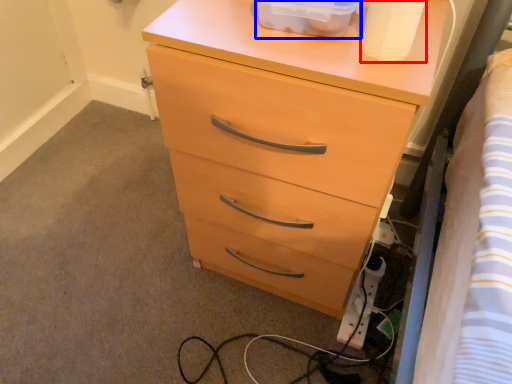
Question: Which object appears closest to the camera in this image, toilet paper (highlighted by a red box) or storage box (highlighted by a blue box)?

Choices:
 (A) toilet paper
 (B) storage box

Answer: (A)